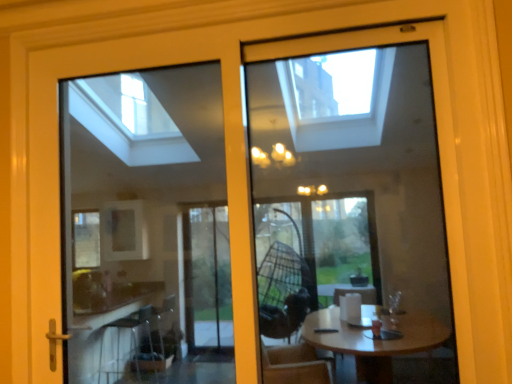
What are the coordinates of `free space above white plastic window frame at upper center (from a real-world perspective)` in the screenshot? It's located at (343, 24).